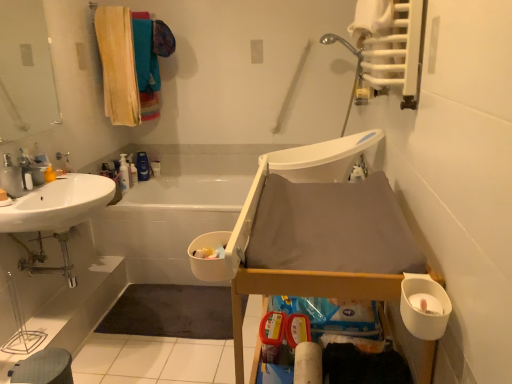
Question: From a real-world perspective, is translucent plastic bottle at upper center, which is the first toiletry from back to front, positioned above or below white plastic bath at lower left?

Choices:
 (A) below
 (B) above

Answer: (B)

Question: Looking at their shapes, would you say translucent plastic bottle at upper center, marked as the 2th toiletry in a front-to-back arrangement, is wider or thinner than white plastic bath at lower left?

Choices:
 (A) wide
 (B) thin

Answer: (B)

Question: Which of these objects is positioned closest to the white glossy sink at left?

Choices:
 (A) soft yellow towel at upper left
 (B) translucent plastic bottle at upper center, which is the first toiletry from back to front
 (C) gray fabric step stool at lower left
 (D) white matte toilet paper at lower center, placed as the 2th toilet paper when sorted from top to bottom
 (E) transparent glass mirror at upper left

Answer: (C)

Question: Which object is the farthest from the white plastic bath at lower left?

Choices:
 (A) white matte toilet paper at lower center, which appears as the 2th toilet paper when viewed from the front
 (B) white glossy bottle at upper left, which is counted as the 2th toiletry, starting from the back
 (C) transparent glass mirror at upper left
 (D) brushed metal faucet at upper left
 (E) soft yellow towel at upper left

Answer: (A)